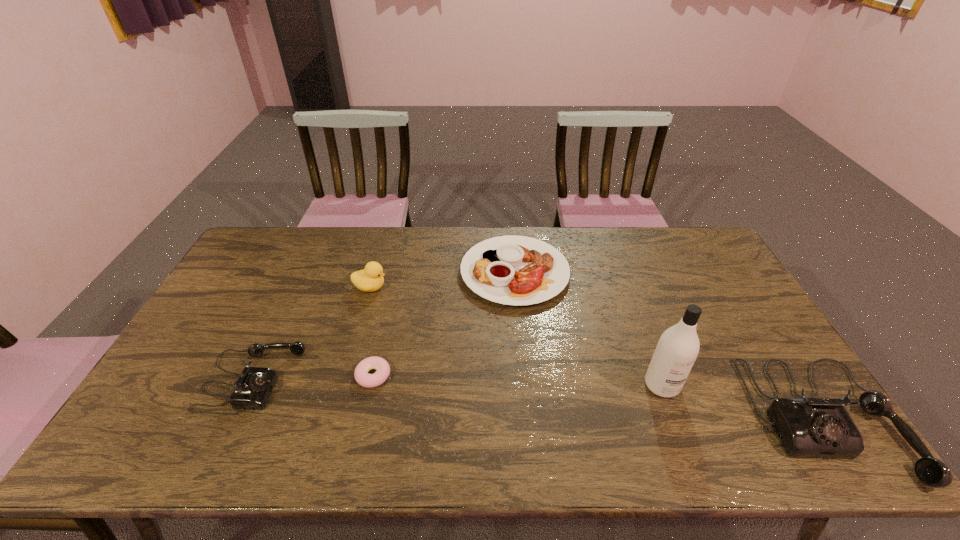
I want to click on vacant space located on the dial of the leftmost object, so click(x=328, y=379).

Find the location of `vacant space situated 0.130m on the left of the second shortest object`. vacant space situated 0.130m on the left of the second shortest object is located at coordinates (421, 272).

The height and width of the screenshot is (540, 960). I want to click on vacant area located on the front-facing side of the duck, so tap(494, 287).

Identify the location of vacant space situated on the right of the shortest object. Image resolution: width=960 pixels, height=540 pixels. point(503,375).

At what (x,y) coordinates should I click in order to perform the action: click on blank area located on the front-facing side of the second object from right to left. Please return your answer as a coordinate pair (x, y). This screenshot has width=960, height=540. Looking at the image, I should click on (674, 418).

Identify the location of object that is at the far edge. The height and width of the screenshot is (540, 960). (516, 270).

I want to click on doughnut situated at the near edge, so click(362, 377).

Where is `shampoo at the near edge`? The width and height of the screenshot is (960, 540). shampoo at the near edge is located at coordinates (678, 347).

Identify the location of object present at the left edge. The height and width of the screenshot is (540, 960). (252, 390).

Locate an element on the screen. The height and width of the screenshot is (540, 960). object that is positioned at the right edge is located at coordinates (808, 427).